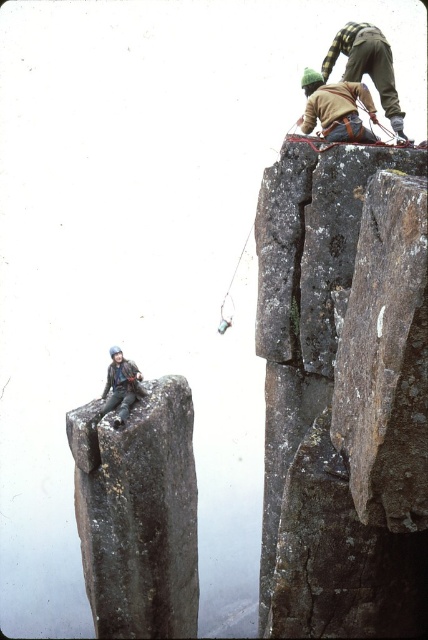
Does dark gray rock at left come behind matte brown jacket at upper right?

Yes, dark gray rock at left is further from the viewer.

Does dark gray rock at left have a larger size compared to matte brown jacket at upper right?

Yes.

The height and width of the screenshot is (640, 428). What are the coordinates of `dark gray rock at left` in the screenshot? It's located at (139, 513).

Is matte brown jacket at upper right shorter than matte black jacket at left?

Yes, matte brown jacket at upper right is shorter than matte black jacket at left.

Does matte brown jacket at upper right have a greater width compared to matte black jacket at left?

In fact, matte brown jacket at upper right might be narrower than matte black jacket at left.

What do you see at coordinates (335, 108) in the screenshot?
I see `matte brown jacket at upper right` at bounding box center [335, 108].

Where is `matte brown jacket at upper right`? matte brown jacket at upper right is located at coordinates (x=335, y=108).

The image size is (428, 640). I want to click on dark gray rock at left, so click(139, 513).

Between point (168, 525) and point (300, 342), which one is positioned in front?

Positioned in front is point (300, 342).

Locate an element on the screen. Image resolution: width=428 pixels, height=640 pixels. dark gray rock at left is located at coordinates (139, 513).